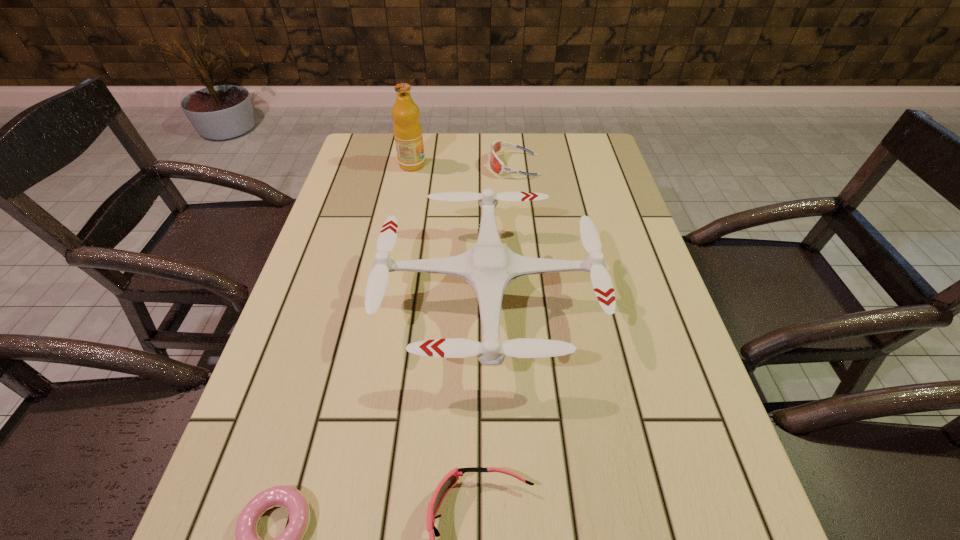
At what (x,y) coordinates should I click in order to perform the action: click on blank space at the far left corner. Please return your answer as a coordinate pair (x, y). Image resolution: width=960 pixels, height=540 pixels. Looking at the image, I should click on (347, 168).

This screenshot has height=540, width=960. I want to click on vacant space at the far right corner of the desktop, so click(596, 154).

Find the location of a particular element. The width and height of the screenshot is (960, 540). empty space that is in between the fruit juice and the taller goggles is located at coordinates (463, 165).

At what (x,y) coordinates should I click in order to perform the action: click on free space between the tallest object and the third farthest object. Please return your answer as a coordinate pair (x, y). The width and height of the screenshot is (960, 540). Looking at the image, I should click on (450, 230).

Find the location of a particular element. The height and width of the screenshot is (540, 960). unoccupied area between the fourth shortest object and the fruit juice is located at coordinates (450, 230).

Select which object appears as the second closest to the fruit juice. Please provide its 2D coordinates. Your answer should be formatted as a tuple, i.e. [(x, y)], where the tuple contains the x and y coordinates of a point satisfying the conditions above.

[(489, 267)]

Locate an element on the screen. the closest object relative to the tallest object is located at coordinates (495, 163).